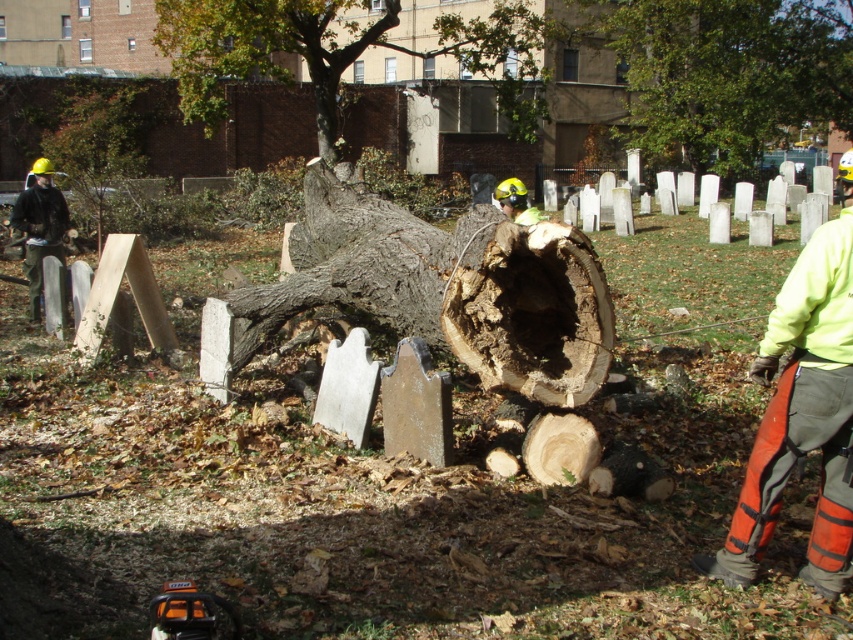
Question: Is neon yellow jacket at right to the right of matte black jacket at left from the viewer's perspective?

Choices:
 (A) no
 (B) yes

Answer: (B)

Question: Among these objects, which one is farthest from the camera?

Choices:
 (A) green leafy tree at center
 (B) green leafy tree at upper center
 (C) matte black jacket at left
 (D) neon yellow jacket at right

Answer: (A)

Question: Is green leafy tree at center wider than matte black jacket at left?

Choices:
 (A) yes
 (B) no

Answer: (A)

Question: Which point appears closest to the camera in this image?

Choices:
 (A) [x=846, y=13]
 (B) [x=534, y=93]

Answer: (A)

Question: Is neon yellow jacket at right to the right of green leafy tree at upper center from the viewer's perspective?

Choices:
 (A) no
 (B) yes

Answer: (B)

Question: Based on their relative distances, which object is farther from the matte black jacket at left?

Choices:
 (A) neon yellow jacket at right
 (B) green leafy tree at center
 (C) green leafy tree at upper center

Answer: (B)